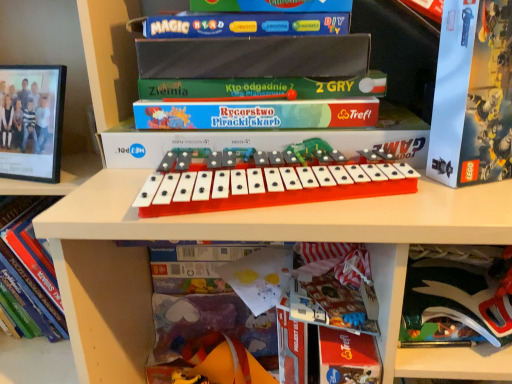
Question: Is the position of orange plastic musical keyboard at center more distant than that of red paper at lower center, which appears as the 4th paperback book when viewed from the top?

Choices:
 (A) yes
 (B) no

Answer: (B)

Question: From the image's perspective, does orange plastic musical keyboard at center appear higher than red paper at lower center, the 1th paperback book from the bottom?

Choices:
 (A) yes
 (B) no

Answer: (A)

Question: Is orange plastic musical keyboard at center surrounding red paper at lower center, the 1th paperback book from the bottom?

Choices:
 (A) no
 (B) yes

Answer: (A)

Question: Can you confirm if orange plastic musical keyboard at center is positioned to the right of red paper at lower center, the 1th paperback book from the bottom?

Choices:
 (A) no
 (B) yes

Answer: (A)

Question: Does orange plastic musical keyboard at center have a greater width compared to red paper at lower center, the 1th paperback book from the bottom?

Choices:
 (A) no
 (B) yes

Answer: (B)

Question: Is orange plastic musical keyboard at center to the left of red paper at lower center, the 1th paperback book from the bottom, from the viewer's perspective?

Choices:
 (A) no
 (B) yes

Answer: (B)

Question: Considering the relative sizes of red paper at lower center, the 1th paperback book from the bottom, and hardcover book at center, which is counted as the third book, starting from the left, in the image provided, is red paper at lower center, the 1th paperback book from the bottom, bigger than hardcover book at center, which is counted as the third book, starting from the left,?

Choices:
 (A) yes
 (B) no

Answer: (A)

Question: Does red paper at lower center, which appears as the 4th paperback book when viewed from the top, have a smaller size compared to hardcover book at center, which is counted as the third book, starting from the left?

Choices:
 (A) no
 (B) yes

Answer: (A)

Question: Considering the relative positions of red paper at lower center, which appears as the 4th paperback book when viewed from the top, and hardcover book at center, which is counted as the third book, starting from the left, in the image provided, is red paper at lower center, which appears as the 4th paperback book when viewed from the top, to the left of hardcover book at center, which is counted as the third book, starting from the left, from the viewer's perspective?

Choices:
 (A) yes
 (B) no

Answer: (B)

Question: Is red paper at lower center, the 1th paperback book from the bottom, placed right next to hardcover book at center, which appears as the first book when viewed from the right?

Choices:
 (A) no
 (B) yes

Answer: (B)

Question: From the image's perspective, would you say red paper at lower center, which appears as the 4th paperback book when viewed from the top, is positioned over hardcover book at center, which is counted as the third book, starting from the left?

Choices:
 (A) yes
 (B) no

Answer: (B)

Question: Is red paper at lower center, which appears as the 4th paperback book when viewed from the top, to the right of hardcover book at center, which is counted as the third book, starting from the left, from the viewer's perspective?

Choices:
 (A) yes
 (B) no

Answer: (A)

Question: Does matte black scissors at lower right, which is counted as the second paperback book, starting from the bottom, lie behind red paper at lower center, which appears as the 4th paperback book when viewed from the top?

Choices:
 (A) no
 (B) yes

Answer: (A)